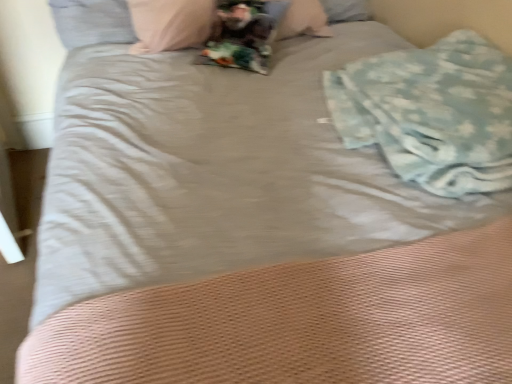
Question: Does gray fabric pillow at upper left have a lesser width compared to light blue textured blanket at right?

Choices:
 (A) no
 (B) yes

Answer: (B)

Question: Is gray fabric pillow at upper left with light blue textured blanket at right?

Choices:
 (A) yes
 (B) no

Answer: (B)

Question: Is gray fabric pillow at upper left at the left side of light blue textured blanket at right?

Choices:
 (A) no
 (B) yes

Answer: (B)

Question: Is gray fabric pillow at upper left positioned beyond the bounds of light blue textured blanket at right?

Choices:
 (A) no
 (B) yes

Answer: (B)

Question: Is gray fabric pillow at upper left positioned before light blue textured blanket at right?

Choices:
 (A) no
 (B) yes

Answer: (A)

Question: Is gray fabric pillow at upper left smaller than light blue textured blanket at right?

Choices:
 (A) no
 (B) yes

Answer: (B)

Question: From the image's perspective, is light blue textured blanket at right located beneath gray fabric pillow at upper left?

Choices:
 (A) no
 (B) yes

Answer: (B)

Question: Does light blue textured blanket at right have a larger size compared to gray fabric pillow at upper left?

Choices:
 (A) yes
 (B) no

Answer: (A)

Question: From a real-world perspective, is light blue textured blanket at right over gray fabric pillow at upper left?

Choices:
 (A) yes
 (B) no

Answer: (A)

Question: Considering the relative sizes of light blue textured blanket at right and gray fabric pillow at upper left in the image provided, is light blue textured blanket at right taller than gray fabric pillow at upper left?

Choices:
 (A) no
 (B) yes

Answer: (A)

Question: Is the position of light blue textured blanket at right less distant than that of gray fabric pillow at upper left?

Choices:
 (A) yes
 (B) no

Answer: (A)

Question: Is light blue textured blanket at right aimed at gray fabric pillow at upper left?

Choices:
 (A) yes
 (B) no

Answer: (B)

Question: Considering the positions of light blue textured blanket at right and gray fabric pillow at upper left in the image, is light blue textured blanket at right wider or thinner than gray fabric pillow at upper left?

Choices:
 (A) thin
 (B) wide

Answer: (B)